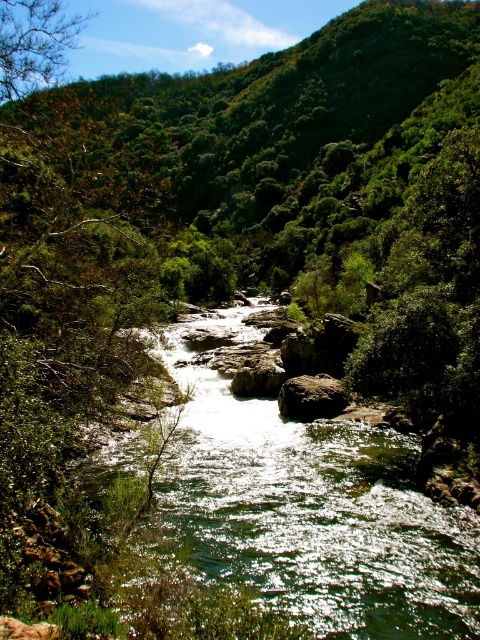
Between point (391, 632) and point (339, 403), which one is positioned behind?

The point (339, 403) is more distant.

Describe the element at coordinates (308, 508) in the screenshot. This screenshot has height=640, width=480. I see `green translucent water at center` at that location.

Is point (402, 515) behind point (344, 387)?

No, (402, 515) is in front of (344, 387).

Locate an element on the screen. The height and width of the screenshot is (640, 480). green translucent water at center is located at coordinates (308, 508).